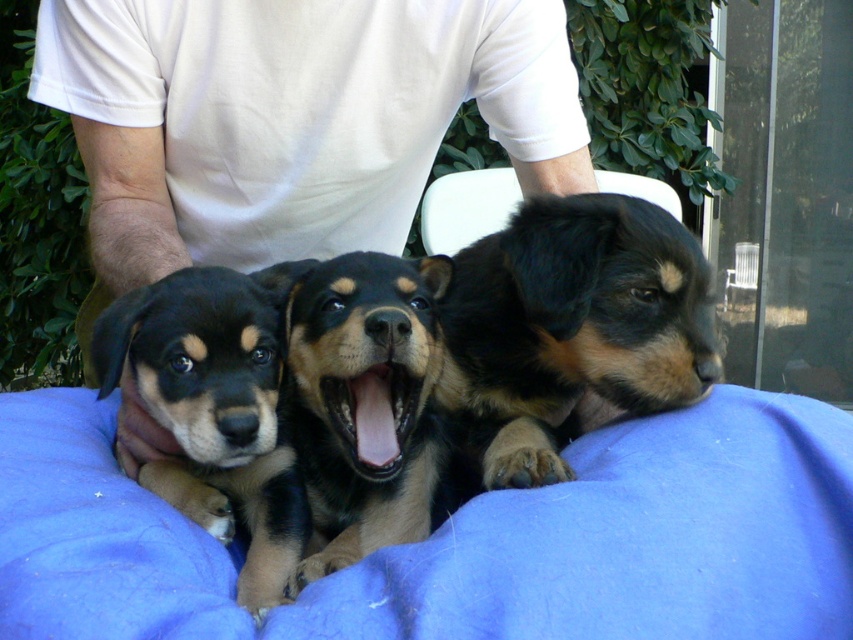
Can you confirm if black fur dog at center is positioned to the left of brown fuzzy dog at center?

No, black fur dog at center is not to the left of brown fuzzy dog at center.

In the scene shown: Can you confirm if black fur dog at center is shorter than brown fuzzy dog at center?

Indeed, black fur dog at center has a lesser height compared to brown fuzzy dog at center.

Between point (473, 304) and point (347, 378), which one is positioned behind?

The point (473, 304) is more distant.

What are the coordinates of `black fur dog at center` in the screenshot? It's located at (572, 326).

Between black fur puppy at left and brown fuzzy dog at center, which one has less height?

black fur puppy at left is shorter.

Who is lower down, black fur puppy at left or brown fuzzy dog at center?

black fur puppy at left

Where is `black fur puppy at left`? The height and width of the screenshot is (640, 853). black fur puppy at left is located at coordinates (216, 408).

In the scene shown: Who is more forward, (595,604) or (282,445)?

Point (595,604) is in front.

Can you confirm if blue fabric at center is positioned to the left of black fur puppy at left?

Incorrect, blue fabric at center is not on the left side of black fur puppy at left.

The image size is (853, 640). I want to click on blue fabric at center, so click(x=461, y=540).

You are a GUI agent. You are given a task and a screenshot of the screen. Output one action in this format:
    pyautogui.click(x=<x>, y=<y>)
    Task: Click on the blue fabric at center
    This screenshot has width=853, height=640.
    Given the screenshot: What is the action you would take?
    pyautogui.click(x=461, y=540)